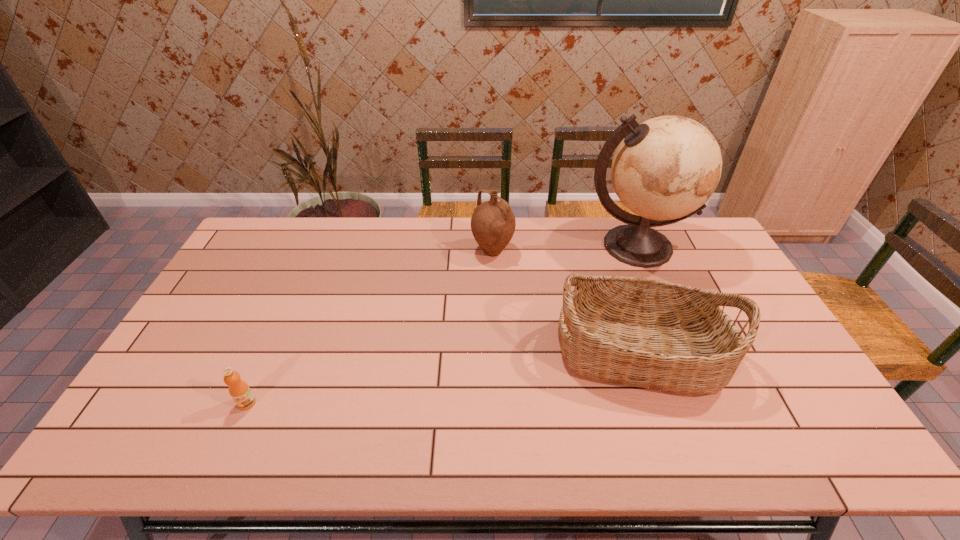
Where is `the tallest object`? The image size is (960, 540). the tallest object is located at coordinates (664, 170).

Find the location of a particular element. The width and height of the screenshot is (960, 540). pitcher is located at coordinates (493, 223).

Locate an element on the screen. Image resolution: width=960 pixels, height=540 pixels. basket is located at coordinates (646, 333).

In order to click on the leftmost object in this screenshot , I will do `click(239, 390)`.

Where is `orange juice`? The image size is (960, 540). orange juice is located at coordinates (239, 390).

The width and height of the screenshot is (960, 540). Identify the location of vacant position located on the front-facing side of the tallest object. (x=676, y=342).

The height and width of the screenshot is (540, 960). What are the coordinates of `vacant space located on the back of the pitcher` in the screenshot? It's located at (492, 224).

Locate an element on the screen. This screenshot has width=960, height=540. vacant space positioned on the left of the basket is located at coordinates (538, 353).

This screenshot has width=960, height=540. Find the location of `vacant position located 0.090m on the front label of the leftmost object`. vacant position located 0.090m on the front label of the leftmost object is located at coordinates (228, 446).

At what (x,y) coordinates should I click in order to perform the action: click on globe present at the far edge. Please return your answer as a coordinate pair (x, y). Looking at the image, I should click on (664, 170).